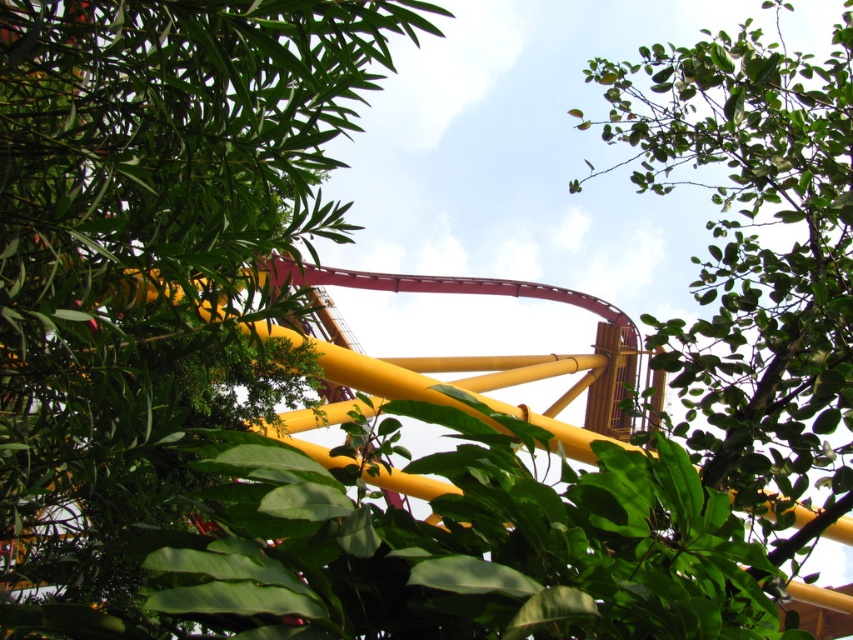
You are a photographer standing at the camera position. You want to capture a photo of the green leafy tree at upper left. The camera has a maximum focus range of 40 meters. Will the tree be in focus?

The green leafy tree at upper left is 42.80 meters from camera, which is beyond the camera maximum focus range of 40 meters. The tree will not be in focus.

You are standing in the amusement park and see the bright yellow and red roller coaster track. There is a point marked at coordinates (149, 260). What object is located at that point?

The point at coordinates (149, 260) corresponds to a green leafy tree at upper left.

You are standing at the entrance of the roller coaster and see two points marked in the scene. Which point is closer to you, point (292, 353) or point (712, 188)?

Point (292, 353) is closer to you because it is further to the viewer than point (712, 188).